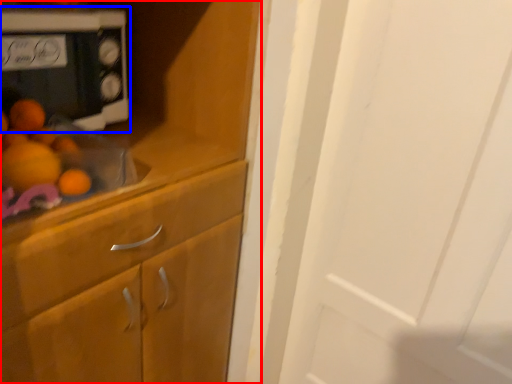
Question: Which point is closer to the camera, cabinetry (highlighted by a red box) or home appliance (highlighted by a blue box)?

Choices:
 (A) cabinetry
 (B) home appliance

Answer: (A)